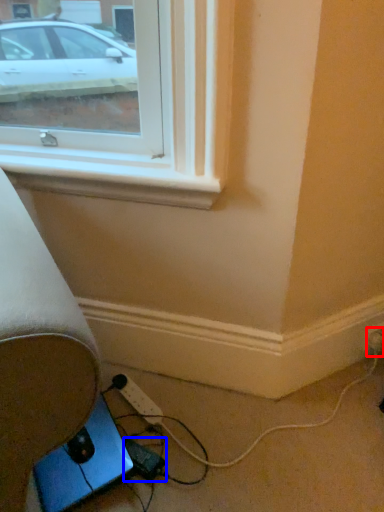
Question: Which object appears farthest to the camera in this image, electric outlet (highlighted by a red box) or extension cord (highlighted by a blue box)?

Choices:
 (A) electric outlet
 (B) extension cord

Answer: (A)